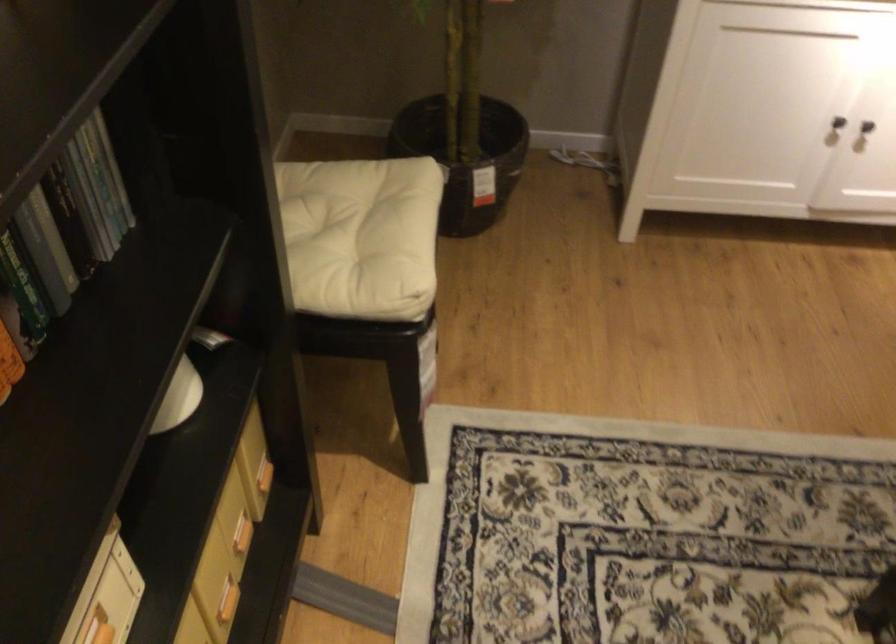
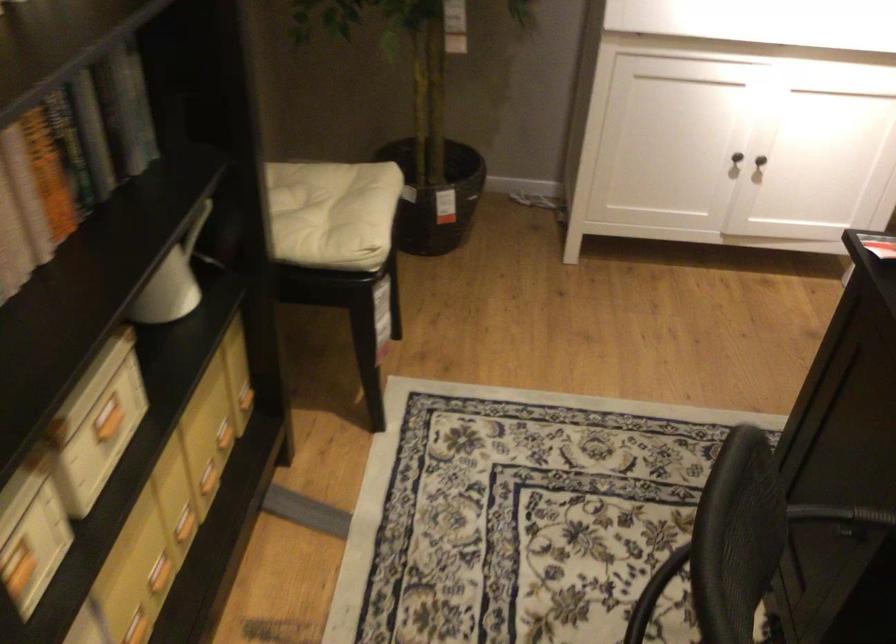
Question: The images are taken continuously from a first-person perspective. In which direction is your viewpoint rotating?

Choices:
 (A) Left
 (B) Right
 (C) Up
 (D) Down

Answer: (C)